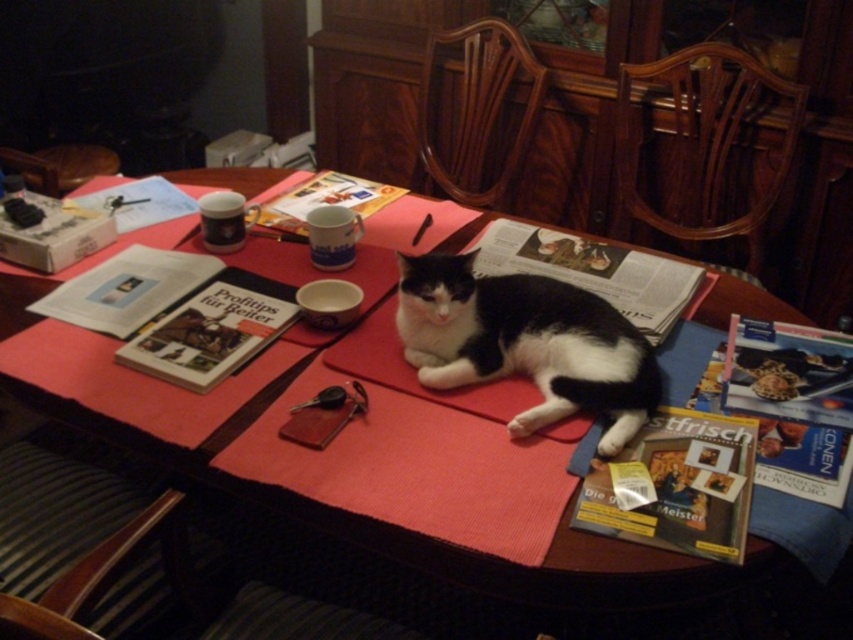
Question: In this image, where is smooth wooden table at center located relative to black and white fur cat at center?

Choices:
 (A) below
 (B) above

Answer: (B)

Question: Which point is farther from the camera taking this photo?

Choices:
 (A) (442, 308)
 (B) (184, 221)

Answer: (B)

Question: Is smooth wooden table at center positioned at the back of black and white fur cat at center?

Choices:
 (A) yes
 (B) no

Answer: (B)

Question: Is smooth wooden table at center bigger than black and white fur cat at center?

Choices:
 (A) yes
 (B) no

Answer: (A)